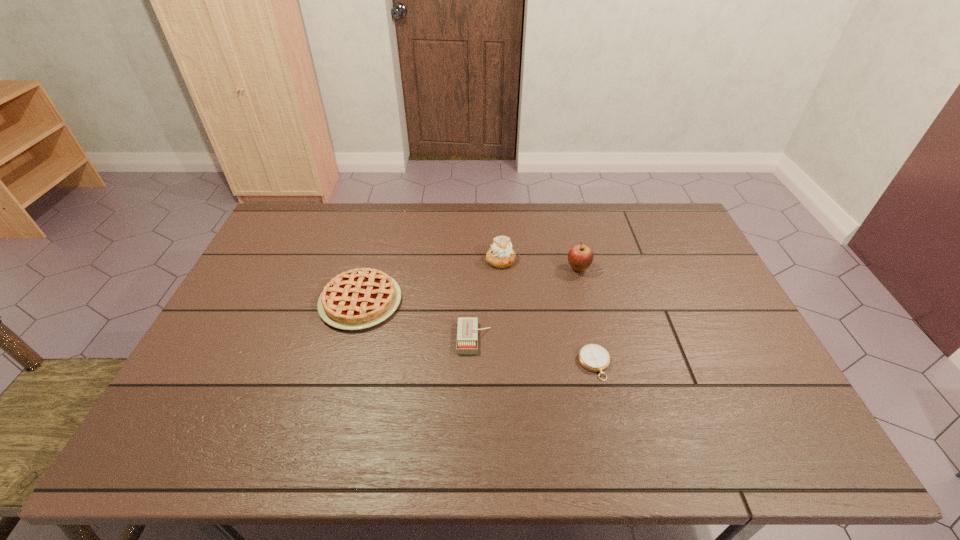
This screenshot has width=960, height=540. What are the coordinates of `empty space between the apple and the matchbox` in the screenshot? It's located at (526, 303).

The height and width of the screenshot is (540, 960). Find the location of `vacant point located between the pastry and the pie`. vacant point located between the pastry and the pie is located at coordinates (431, 281).

I want to click on free spot between the matchbox and the third shortest object, so click(418, 320).

I want to click on blank region between the leftmost object and the fourth tallest object, so click(x=418, y=320).

The height and width of the screenshot is (540, 960). Identify the location of vacant space that is in between the matchbox and the pie. (418, 320).

This screenshot has width=960, height=540. What are the coordinates of `the closest object to the pastry` in the screenshot? It's located at (580, 257).

The height and width of the screenshot is (540, 960). Identify the location of the third closest object to the shortest object. (501, 255).

The height and width of the screenshot is (540, 960). What are the coordinates of `free space that satisfies the following two spatial constraints: 1. on the striking surface of the matchbox; 2. on the left side of the shortest object` in the screenshot? It's located at [474, 364].

Identify the location of vacant position in the image that satisfies the following two spatial constraints: 1. on the striking surface of the shortest object; 2. on the right side of the second shortest object. The image size is (960, 540). (474, 364).

You are a GUI agent. You are given a task and a screenshot of the screen. Output one action in this format:
    pyautogui.click(x=<x>, y=<y>)
    Task: Click on the free space that satisfies the following two spatial constraints: 1. on the back side of the shortest object; 2. on the right side of the apple
    The width and height of the screenshot is (960, 540).
    Given the screenshot: What is the action you would take?
    pyautogui.click(x=572, y=268)